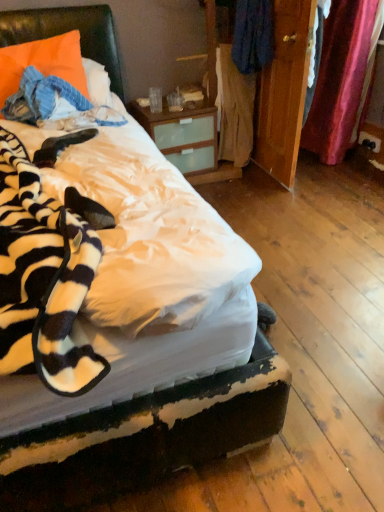
Question: In the image, is light brown fabric at center, the 2th clothing when ordered from top to bottom, positioned in front of or behind blue fabric at center, marked as the second clothing in a bottom-to-top arrangement?

Choices:
 (A) front
 (B) behind

Answer: (B)

Question: From a real-world perspective, is light brown fabric at center, which ranks as the 1th clothing in bottom-to-top order, physically located above or below blue fabric at center, marked as the second clothing in a bottom-to-top arrangement?

Choices:
 (A) above
 (B) below

Answer: (B)

Question: Which is farther from the blue fabric at center, marked as the second clothing in a bottom-to-top arrangement?

Choices:
 (A) wooden wardrobe at center
 (B) black plastic power outlet at lower right
 (C) orange fabric pillow at upper left
 (D) light brown fabric at center, which ranks as the 1th clothing in bottom-to-top order

Answer: (B)

Question: Which object is positioned farthest from the orange fabric pillow at upper left?

Choices:
 (A) blue fabric at center, marked as the second clothing in a bottom-to-top arrangement
 (B) black plastic power outlet at lower right
 (C) light brown fabric at center, the 2th clothing when ordered from top to bottom
 (D) wooden wardrobe at center

Answer: (B)